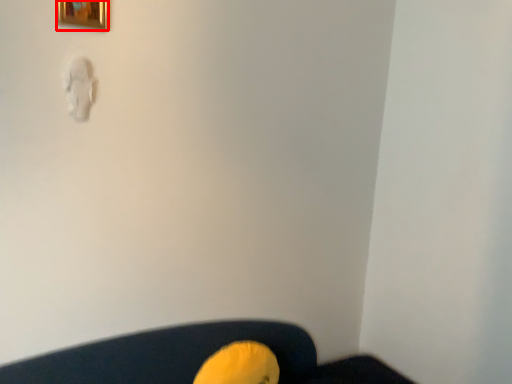
Question: Where is picture frame (annotated by the red box) located in relation to bean bag chair in the image?

Choices:
 (A) right
 (B) left

Answer: (B)